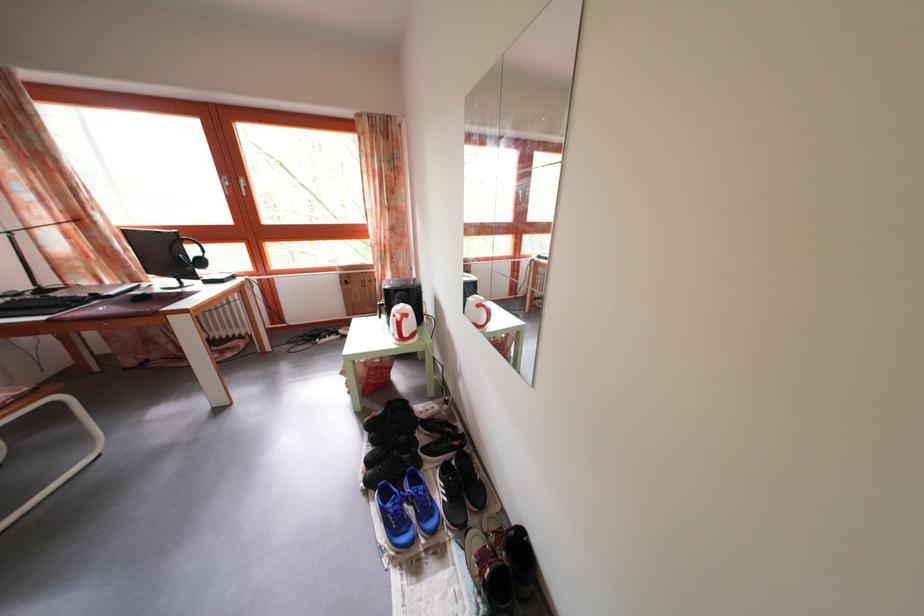
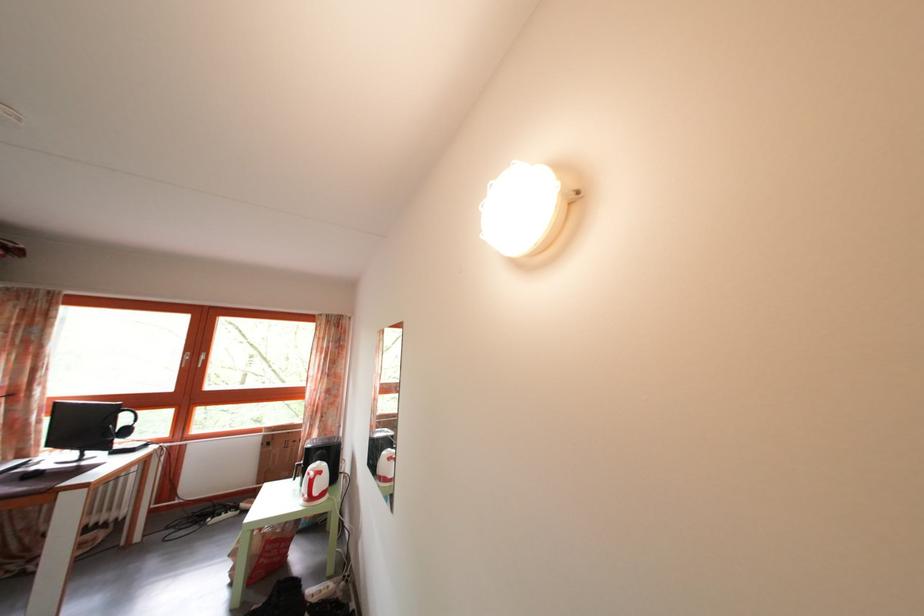
In the second image, find the point that corresponds to (x=375, y=385) in the first image.

(268, 562)